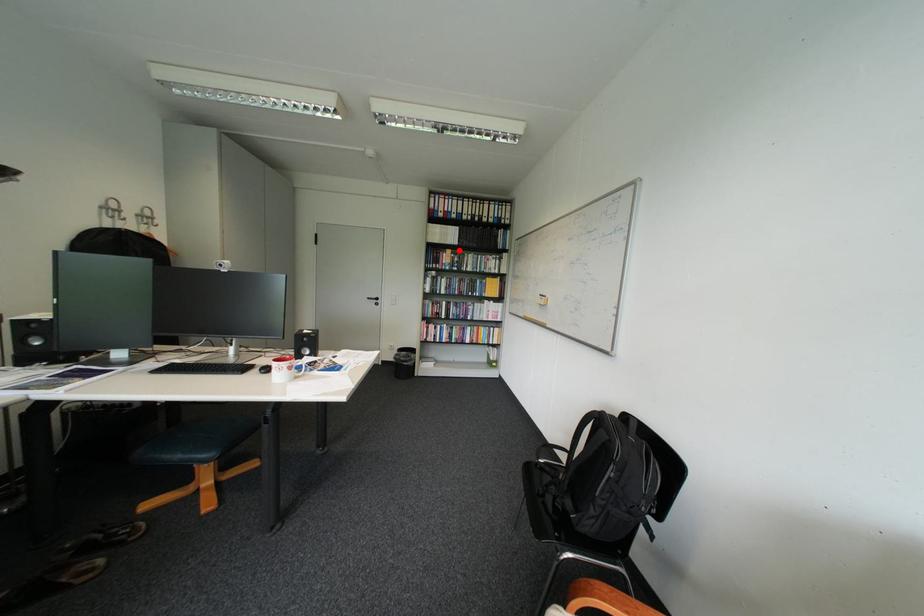
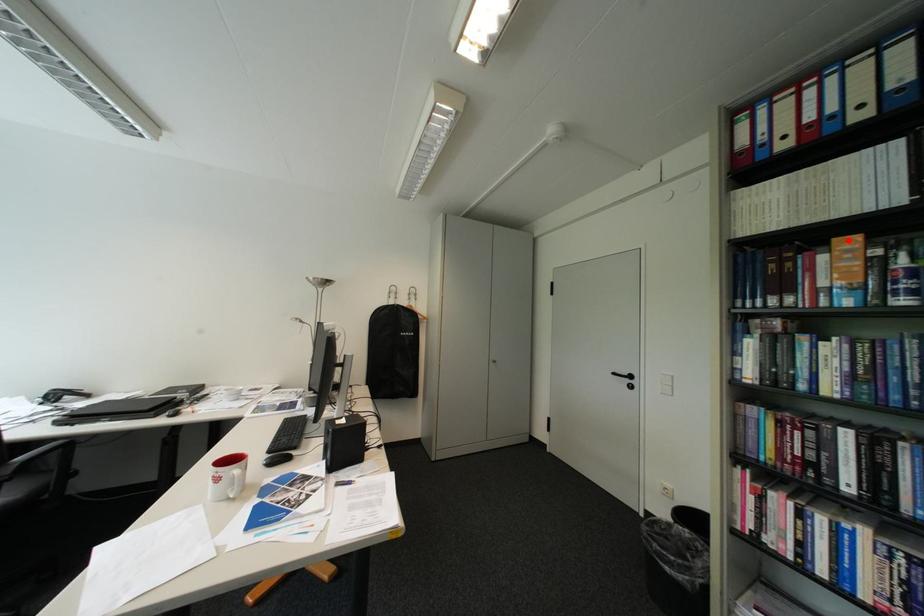
I am providing you with two images of the same scene from different viewpoints. A red point is marked on the first image and another point is marked on the second image. Are the points marked in image1 and image2 representing the same 3D position?

Yes